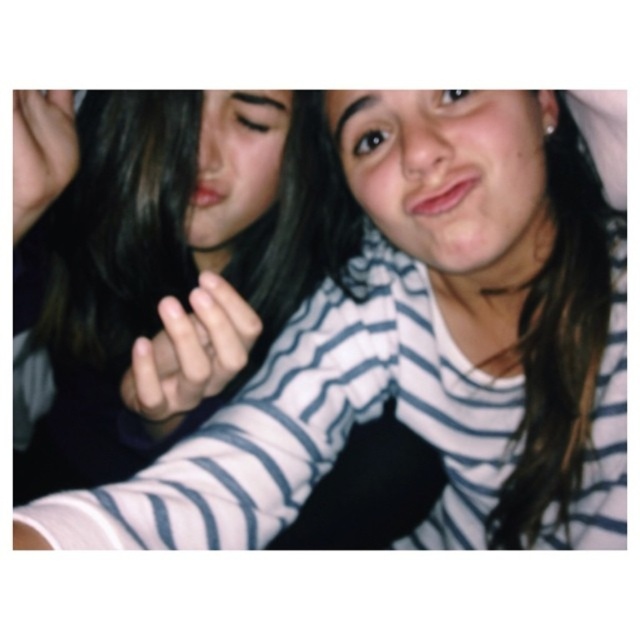
You are taking a photo with two friends. One is wearing a white striped shirt at center and the other has a smooth skin hand at upper left. If you want to ensure the hand is visible in the photo, should you adjust the camera focus or the subjects positions?

The white striped shirt at center is in front of the smooth skin hand at upper left, so you should adjust the subjects positions to move the white striped shirt at center away from the smooth skin hand at upper left to make the hand visible.